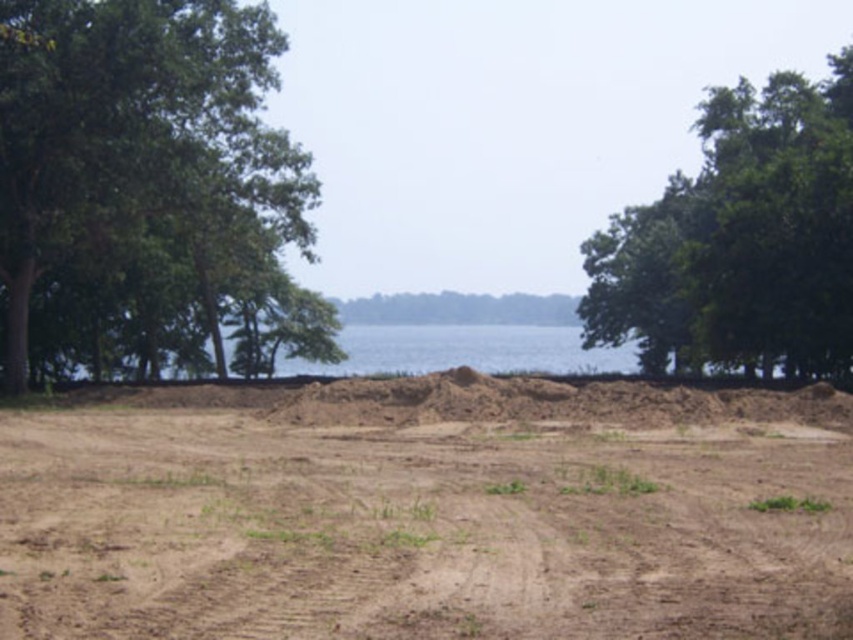
At what (x,y) coordinates should I click in order to perform the action: click on brown sandy dirt at center. Please return your answer as a coordinate pair (x, y). The image size is (853, 640). Looking at the image, I should click on (428, 513).

Is brown sandy dirt at center taller than green leafy tree at left?

No.

Is point (817, 456) more distant than point (309, 326)?

No, (817, 456) is closer to viewer.

Where is `brown sandy dirt at center`? The height and width of the screenshot is (640, 853). brown sandy dirt at center is located at coordinates (428, 513).

In the scene shown: Between brown sandy dirt at center and green leafy tree at upper right, which one is positioned lower?

brown sandy dirt at center

Is brown sandy dirt at center closer to camera compared to green leafy tree at upper right?

Yes, brown sandy dirt at center is in front of green leafy tree at upper right.

Between point (286, 426) and point (843, 234), which one is positioned behind?

Positioned behind is point (843, 234).

Where is `brown sandy dirt at center`? The height and width of the screenshot is (640, 853). brown sandy dirt at center is located at coordinates (428, 513).

Does green leafy tree at left appear under green leafy tree at upper right?

Indeed, green leafy tree at left is positioned under green leafy tree at upper right.

Can you confirm if green leafy tree at left is smaller than green leafy tree at upper right?

Indeed, green leafy tree at left has a smaller size compared to green leafy tree at upper right.

Between point (42, 104) and point (730, 170), which one is positioned in front?

Point (42, 104) is more forward.

Find the location of a particular element. The height and width of the screenshot is (640, 853). green leafy tree at left is located at coordinates (148, 193).